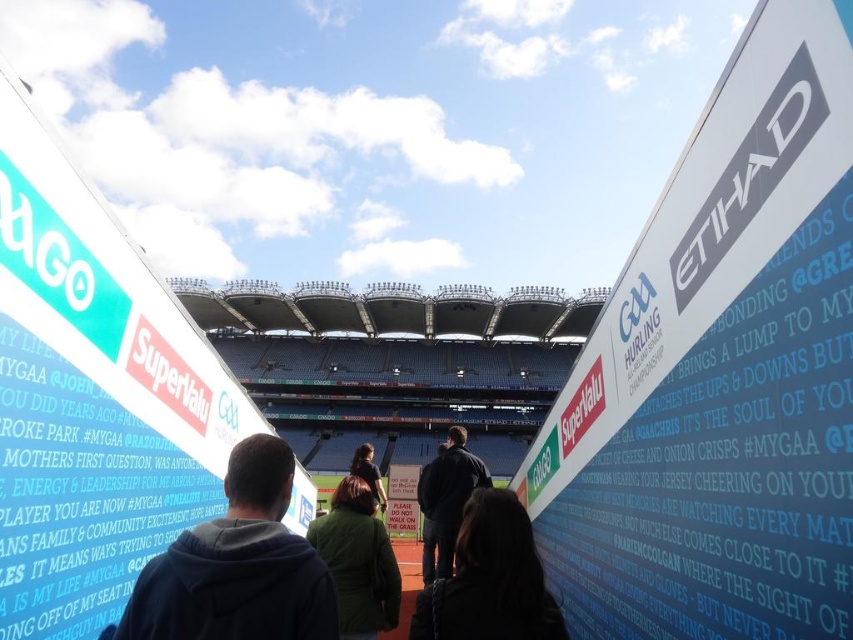
Question: Which object is positioned closest to the dark green jacket at center?

Choices:
 (A) dark blue jacket at center
 (B) dark blue hoodie at center

Answer: (B)

Question: Can you confirm if dark blue hoodie at center is positioned above dark green jacket at center?

Choices:
 (A) no
 (B) yes

Answer: (B)

Question: Estimate the real-world distances between objects in this image. Which object is farther from the dark blue jacket at center?

Choices:
 (A) green matte jacket at center
 (B) dark green jacket at center
 (C) dark brown hair at center
 (D) dark blue hoodie at center

Answer: (D)

Question: Which of these objects is positioned farthest from the dark blue hoodie at center?

Choices:
 (A) dark brown hair at center
 (B) dark blue jacket at center
 (C) dark green jacket at center
 (D) white plastic sign at right

Answer: (B)

Question: Considering the relative positions of dark blue hoodie at center and dark blue jacket at center in the image provided, where is dark blue hoodie at center located with respect to dark blue jacket at center?

Choices:
 (A) left
 (B) right

Answer: (A)

Question: Is green matte jacket at center positioned in front of dark brown hair at center?

Choices:
 (A) yes
 (B) no

Answer: (A)